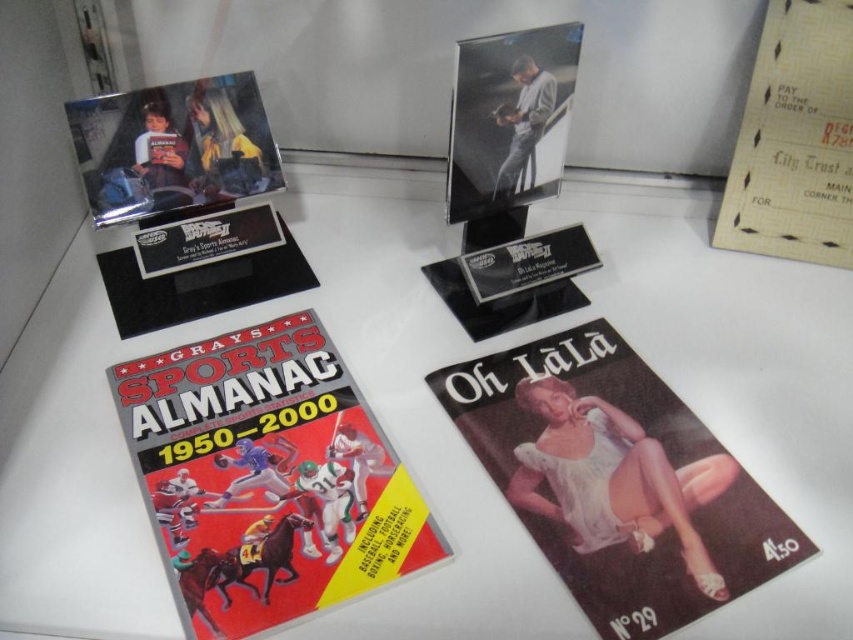
You are a visitor at the museum exhibit and want to take a photo of the white glossy table at center and the yellow paper check at upper right. Which object should you focus on first if you want to capture both in the same frame without moving your camera?

You should focus on the white glossy table at center first because it is closer to you than the yellow paper check at upper right, allowing both to be in the same frame without moving the camera.

From the picture: You are standing in front of a museum exhibit with two points marked on the display. The first point is at coordinates point (303, 376) and the second is at point (120, 122). Which point is closer to you?

Point (303, 376) is closer to the viewer than point (120, 122).